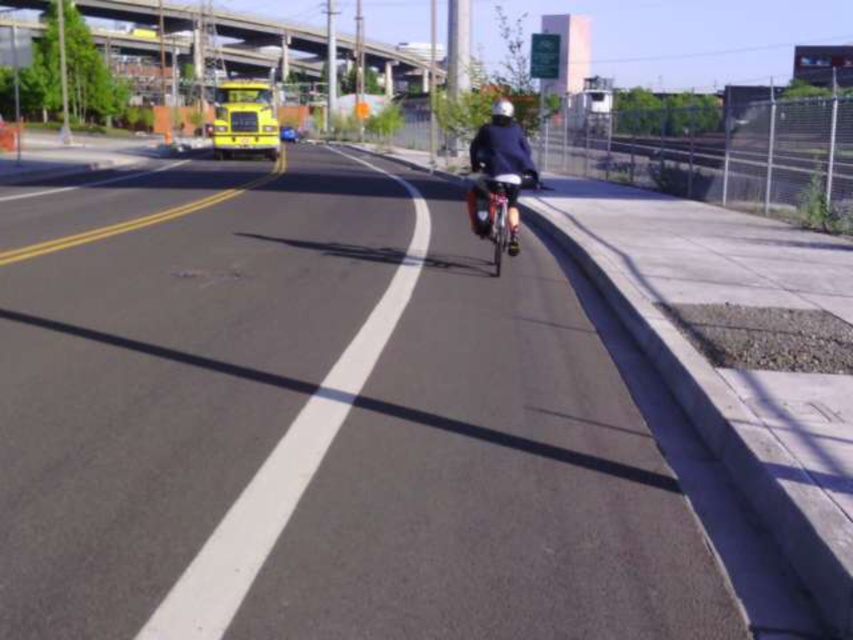
You are a pedestrian standing at the intersection and want to cross the road to reach the concrete bridge at upper center. There is a dark blue fabric at center blocking your path. Which object should you move around to safely reach your destination?

You should move around the dark blue fabric at center because the concrete bridge at upper center is positioned over it, meaning the fabric is below the bridge and blocking the path. By moving around the fabric, you can access the bridge safely.

You are a cyclist planning to ride along the bike lane in the image. There is a dark blue fabric at center located at point (498, 170). Is there enough space to safely pass around it while staying within the bike lane?

The dark blue fabric at center is located at point (498, 170). Since the bike lane is marked by a white line running parallel to the edge of the road, there should be sufficient space to navigate around the obstacle while remaining within the designated lane.

You are a city planner reviewing this urban scene. The asphalt road at center needs to be extended to meet the concrete bridge at upper center. Given that the current distance between them is 82.15 meters, what is the minimum length of asphalt road extension required to connect them?

The asphalt road at center is 82.15 meters from the concrete bridge at upper center, so the minimum length of asphalt road extension required to connect them is 82.15 meters.